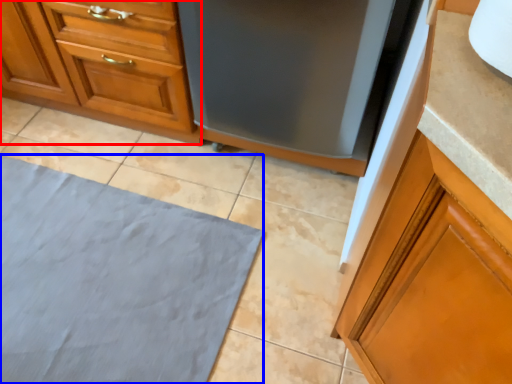
Question: Which object is further to the camera taking this photo, cabinetry (highlighted by a red box) or bath mat (highlighted by a blue box)?

Choices:
 (A) cabinetry
 (B) bath mat

Answer: (A)